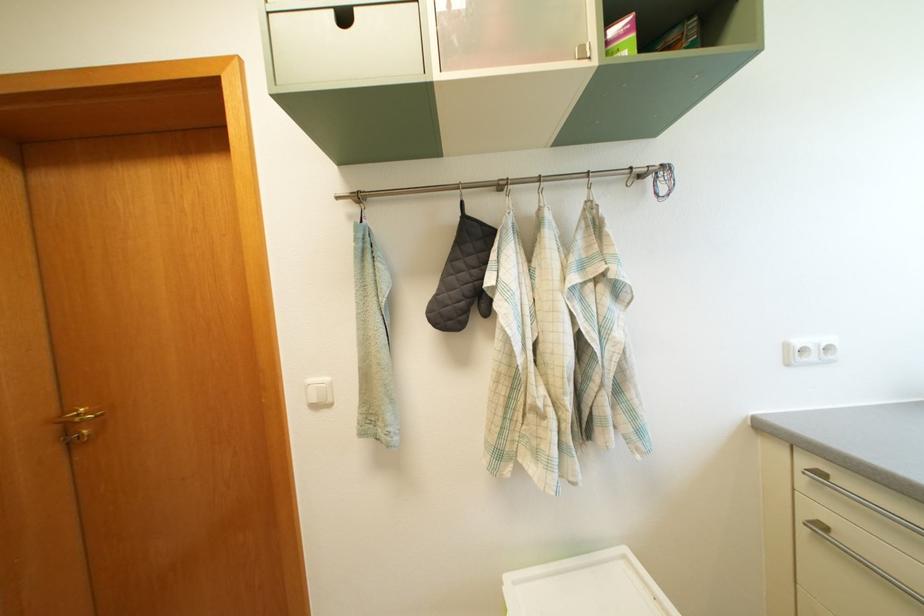
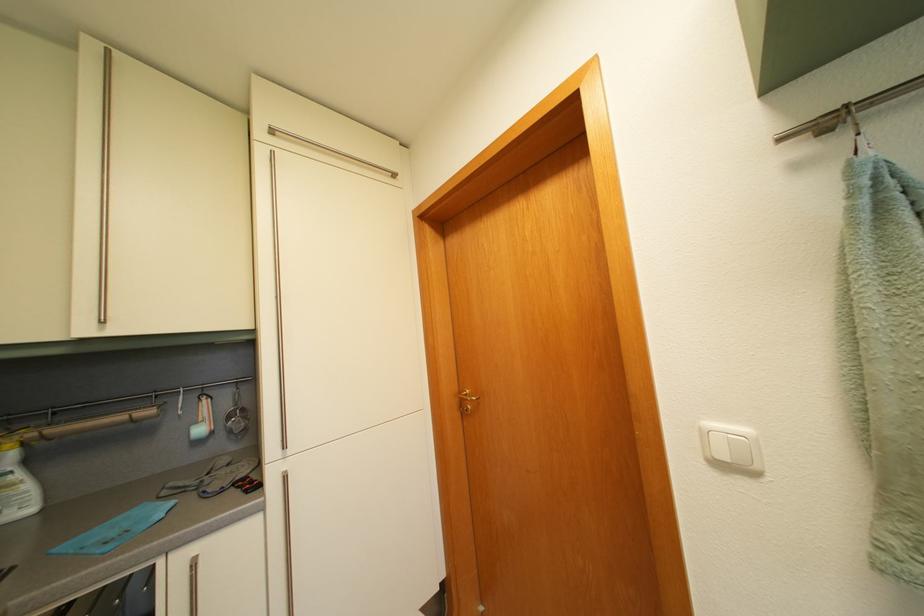
Where in the second image is the point corresponding to (334,387) from the first image?

(755, 438)